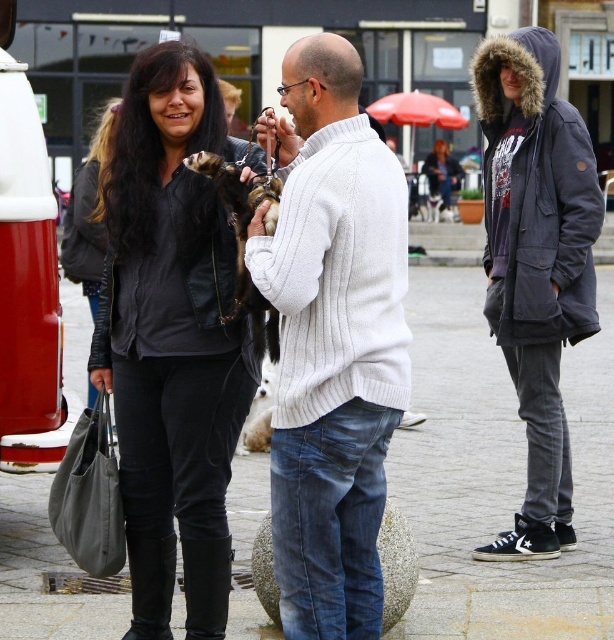
Question: From the image, what is the correct spatial relationship of white ribbed sweater at center in relation to black leather jacket at upper left?

Choices:
 (A) right
 (B) left

Answer: (A)

Question: Can you confirm if white ribbed sweater at center is wider than furry black ferret at center?

Choices:
 (A) no
 (B) yes

Answer: (B)

Question: Which of these objects is positioned farthest from the paved stone pavement at center?

Choices:
 (A) black leather jacket at upper left
 (B) furry black ferret at center
 (C) white ribbed sweater at center
 (D) dark blue hooded parka at right

Answer: (A)

Question: Which of the following is the closest to the observer?

Choices:
 (A) (241, 339)
 (B) (375, 401)
 (C) (526, 364)

Answer: (B)

Question: Which of these objects is positioned farthest from the white ribbed sweater at center?

Choices:
 (A) dark blue hooded parka at right
 (B) furry black ferret at center

Answer: (A)

Question: Is black leather jacket at upper left smaller than furry black ferret at center?

Choices:
 (A) yes
 (B) no

Answer: (B)